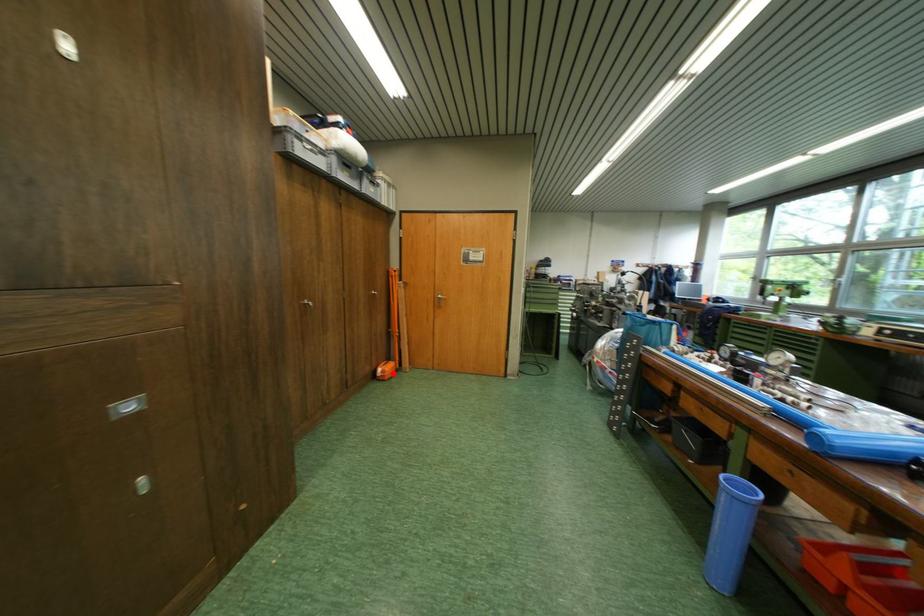
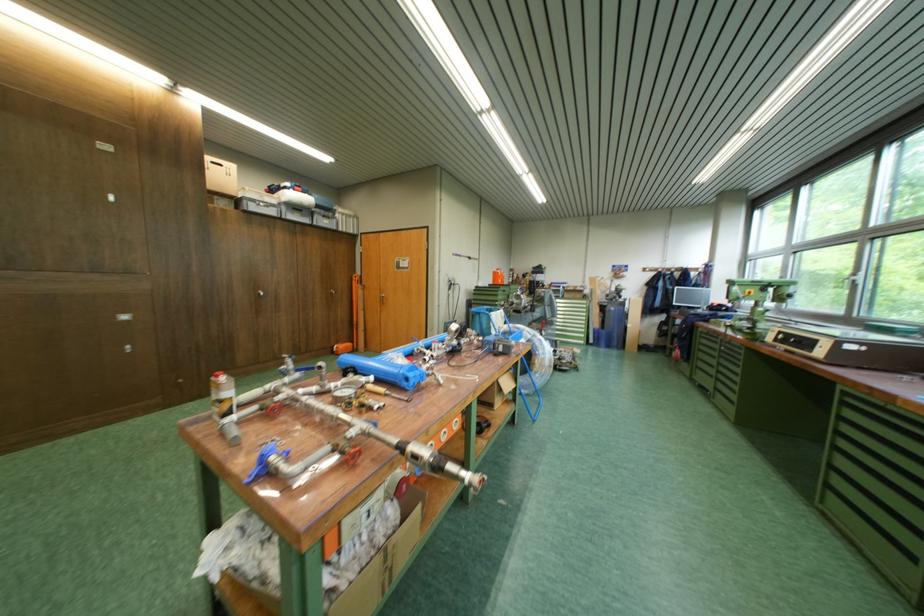
Question: I am providing you with two images of the same scene from different viewpoints. A red point is shown in image1. For the corresponding object point in image2, is it positioned nearer or farther from the camera?

Choices:
 (A) Nearer
 (B) Farther

Answer: (A)